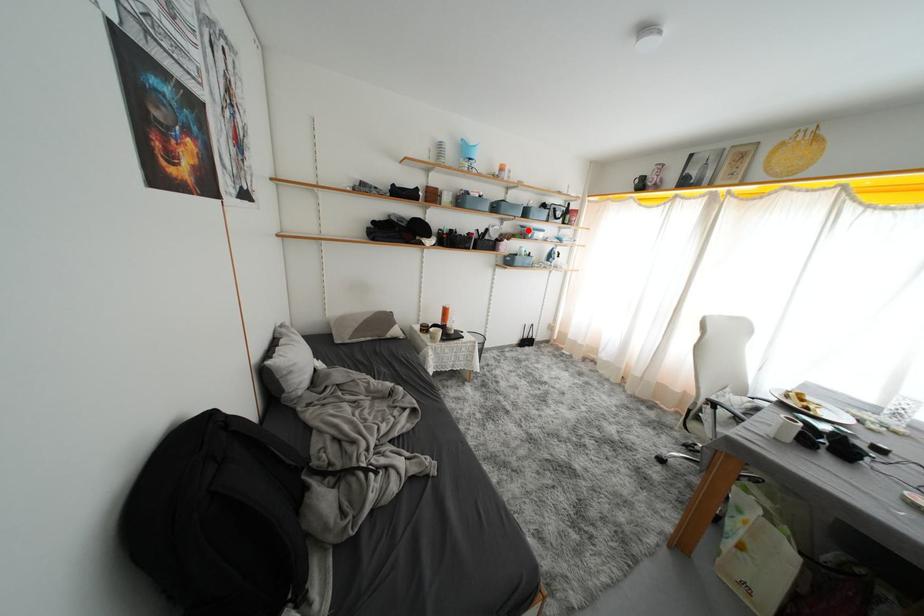
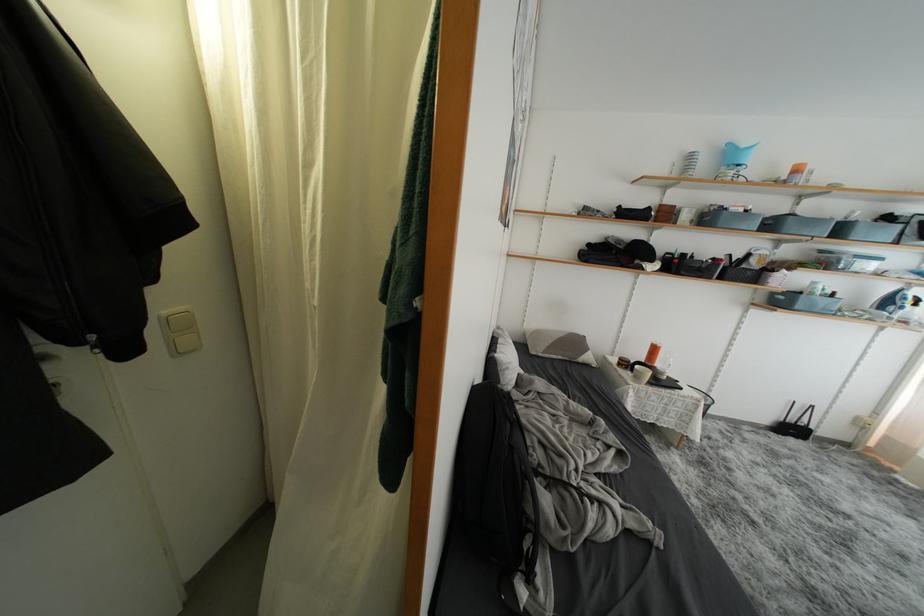
Find the pixel in the second image that matches the highlighted location in the first image.

(829, 256)